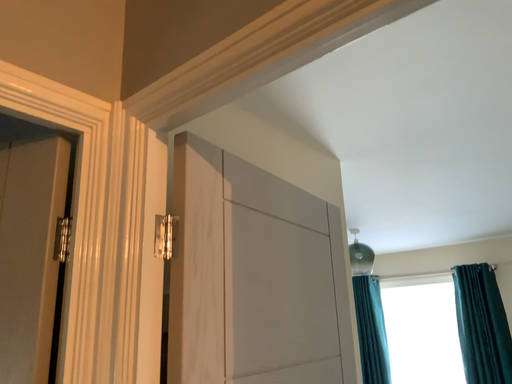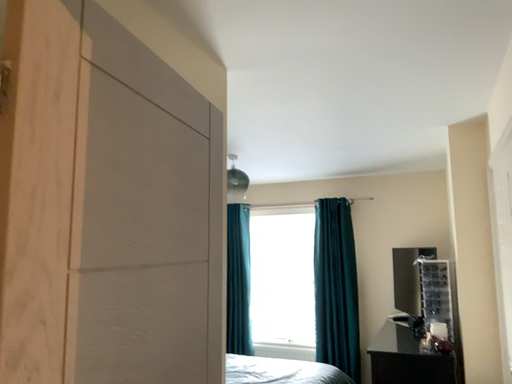
Question: How did the camera likely rotate when shooting the video?

Choices:
 (A) rotated right
 (B) rotated left

Answer: (A)